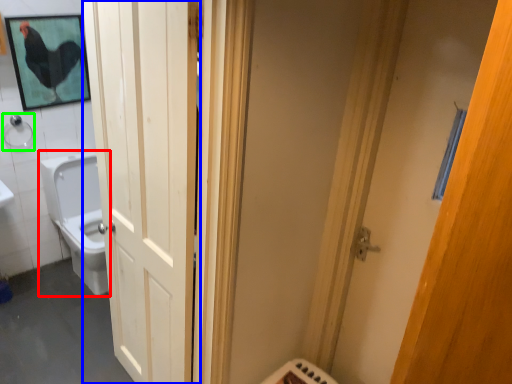
Question: Which object is the farthest from toilet (highlighted by a red box)? Choose among these: door (highlighted by a blue box) or shower (highlighted by a green box).

Choices:
 (A) door
 (B) shower

Answer: (A)